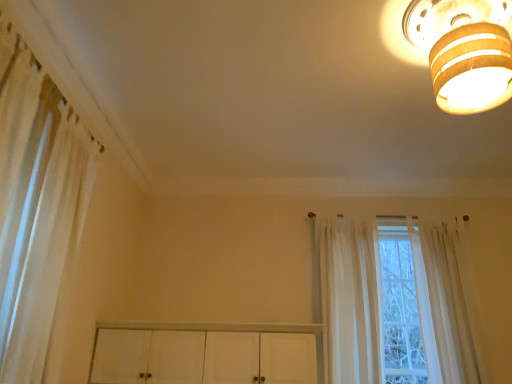
What do you see at coordinates (38, 213) in the screenshot?
I see `white sheer curtain at left, placed as the 1th curtain when sorted from left to right` at bounding box center [38, 213].

Image resolution: width=512 pixels, height=384 pixels. Identify the location of sheer white curtain at center, which appears as the 2th curtain when viewed from the right. (350, 300).

Locate an element on the screen. This screenshot has height=384, width=512. white sheer curtain at left, placed as the 1th curtain when sorted from left to right is located at coordinates (38, 213).

Is white sheer curtain at left, placed as the 1th curtain when sorted from left to right, inside or outside of sheer white curtain at right, which appears as the 3th curtain when viewed from the left?

white sheer curtain at left, placed as the 1th curtain when sorted from left to right, is outside sheer white curtain at right, which appears as the 3th curtain when viewed from the left.

How distant is white sheer curtain at left, marked as the third curtain in a right-to-left arrangement, from sheer white curtain at right, the 1th curtain from the right?

white sheer curtain at left, marked as the third curtain in a right-to-left arrangement, and sheer white curtain at right, the 1th curtain from the right, are 9.21 feet apart from each other.

Does point (56, 311) come behind point (450, 381)?

No, it is in front of (450, 381).

In terms of width, does white sheer curtain at left, marked as the third curtain in a right-to-left arrangement, look wider or thinner when compared to sheer white curtain at right, the 1th curtain from the right?

In the image, white sheer curtain at left, marked as the third curtain in a right-to-left arrangement, appears to be more narrow than sheer white curtain at right, the 1th curtain from the right.

Could you tell me if sheer white curtain at right, the 1th curtain from the right, is turned towards sheer white curtain at center, which appears as the 2th curtain when viewed from the right?

No, sheer white curtain at right, the 1th curtain from the right, is not turned towards sheer white curtain at center, which appears as the 2th curtain when viewed from the right.

Based on the photo, can you confirm if sheer white curtain at right, the 1th curtain from the right, is taller than sheer white curtain at center, positioned as the 2th curtain in left-to-right order?

Incorrect, the height of sheer white curtain at right, the 1th curtain from the right, is not larger of that of sheer white curtain at center, positioned as the 2th curtain in left-to-right order.

Is sheer white curtain at right, which appears as the 3th curtain when viewed from the left, spatially inside sheer white curtain at center, which appears as the 2th curtain when viewed from the right, or outside of it?

sheer white curtain at right, which appears as the 3th curtain when viewed from the left, cannot be found inside sheer white curtain at center, which appears as the 2th curtain when viewed from the right.

Which object is positioned more to the right, sheer white curtain at right, the 1th curtain from the right, or sheer white curtain at center, which appears as the 2th curtain when viewed from the right?

Positioned to the right is sheer white curtain at right, the 1th curtain from the right.

Consider the image. Is wooden ceiling light at upper right oriented away from white sheer curtain at left, placed as the 1th curtain when sorted from left to right?

No, wooden ceiling light at upper right is not facing the opposite direction of white sheer curtain at left, placed as the 1th curtain when sorted from left to right.

Is white sheer curtain at left, marked as the third curtain in a right-to-left arrangement, completely or partially inside wooden ceiling light at upper right?

No, white sheer curtain at left, marked as the third curtain in a right-to-left arrangement, is not surrounded by wooden ceiling light at upper right.

Is wooden ceiling light at upper right in contact with white sheer curtain at left, placed as the 1th curtain when sorted from left to right?

wooden ceiling light at upper right and white sheer curtain at left, placed as the 1th curtain when sorted from left to right, are not in contact.

From the picture: From the image's perspective, which is below, wooden ceiling light at upper right or white sheer curtain at left, placed as the 1th curtain when sorted from left to right?

From the image's view, white sheer curtain at left, placed as the 1th curtain when sorted from left to right, is below.

Who is bigger, sheer white curtain at center, which appears as the 2th curtain when viewed from the right, or sheer white curtain at right, which appears as the 3th curtain when viewed from the left?

sheer white curtain at right, which appears as the 3th curtain when viewed from the left.

Consider the image. Is sheer white curtain at center, which appears as the 2th curtain when viewed from the right, next to sheer white curtain at right, the 1th curtain from the right?

No, sheer white curtain at center, which appears as the 2th curtain when viewed from the right, is not in contact with sheer white curtain at right, the 1th curtain from the right.

Could sheer white curtain at right, which appears as the 3th curtain when viewed from the left, be considered to be inside sheer white curtain at center, which appears as the 2th curtain when viewed from the right?

No, sheer white curtain at right, which appears as the 3th curtain when viewed from the left, is not inside sheer white curtain at center, which appears as the 2th curtain when viewed from the right.

Is sheer white curtain at center, positioned as the 2th curtain in left-to-right order, shorter than sheer white curtain at right, which appears as the 3th curtain when viewed from the left?

In fact, sheer white curtain at center, positioned as the 2th curtain in left-to-right order, may be taller than sheer white curtain at right, which appears as the 3th curtain when viewed from the left.

Is white sheer curtain at left, placed as the 1th curtain when sorted from left to right, inside sheer white curtain at right, the 1th curtain from the right?

No, white sheer curtain at left, placed as the 1th curtain when sorted from left to right, is not a part of sheer white curtain at right, the 1th curtain from the right.

Is sheer white curtain at right, the 1th curtain from the right, touching white sheer curtain at left, placed as the 1th curtain when sorted from left to right?

No, sheer white curtain at right, the 1th curtain from the right, is not in contact with white sheer curtain at left, placed as the 1th curtain when sorted from left to right.

At what (x,y) coordinates should I click in order to perform the action: click on the 2nd curtain above the sheer white curtain at right, the 1th curtain from the right (from the image's perspective). Please return your answer as a coordinate pair (x, y). This screenshot has width=512, height=384. Looking at the image, I should click on (38, 213).

The image size is (512, 384). There is a white sheer curtain at left, placed as the 1th curtain when sorted from left to right. What are the coordinates of `the 1st curtain below it (from the image's perspective)` in the screenshot? It's located at (350, 300).

Looking at this image, considering the sizes of objects white sheer curtain at left, marked as the third curtain in a right-to-left arrangement, and sheer white curtain at center, which appears as the 2th curtain when viewed from the right, in the image provided, who is taller, white sheer curtain at left, marked as the third curtain in a right-to-left arrangement, or sheer white curtain at center, which appears as the 2th curtain when viewed from the right,?

white sheer curtain at left, marked as the third curtain in a right-to-left arrangement.

Can you confirm if white sheer curtain at left, placed as the 1th curtain when sorted from left to right, is smaller than sheer white curtain at center, which appears as the 2th curtain when viewed from the right?

Yes, white sheer curtain at left, placed as the 1th curtain when sorted from left to right, is smaller than sheer white curtain at center, which appears as the 2th curtain when viewed from the right.

Is sheer white curtain at right, the 1th curtain from the right, not close to wooden ceiling light at upper right?

Yes.

Can you tell me how much sheer white curtain at right, the 1th curtain from the right, and wooden ceiling light at upper right differ in facing direction?

There is a 14.4-degree angle between the facing directions of sheer white curtain at right, the 1th curtain from the right, and wooden ceiling light at upper right.

From the picture: Does sheer white curtain at right, the 1th curtain from the right, have a lesser height compared to wooden ceiling light at upper right?

In fact, sheer white curtain at right, the 1th curtain from the right, may be taller than wooden ceiling light at upper right.

Based on the photo, is sheer white curtain at right, which appears as the 3th curtain when viewed from the left, closer to the viewer compared to wooden ceiling light at upper right?

No, it is not.

This screenshot has width=512, height=384. Identify the location of the 2nd curtain to the left of the sheer white curtain at right, which appears as the 3th curtain when viewed from the left, starting your count from the anchor. (38, 213).

Where is `curtain that appears behind the sheer white curtain at right, which appears as the 3th curtain when viewed from the left`? This screenshot has height=384, width=512. curtain that appears behind the sheer white curtain at right, which appears as the 3th curtain when viewed from the left is located at coordinates (350, 300).

Based on their spatial positions, is wooden ceiling light at upper right or sheer white curtain at right, the 1th curtain from the right, further from sheer white curtain at center, which appears as the 2th curtain when viewed from the right?

Among the two, wooden ceiling light at upper right is located further to sheer white curtain at center, which appears as the 2th curtain when viewed from the right.

From the image, which object appears to be nearer to wooden ceiling light at upper right, sheer white curtain at center, positioned as the 2th curtain in left-to-right order, or white sheer curtain at left, placed as the 1th curtain when sorted from left to right?

sheer white curtain at center, positioned as the 2th curtain in left-to-right order, is positioned closer to the anchor wooden ceiling light at upper right.

Based on their spatial positions, is wooden ceiling light at upper right or sheer white curtain at center, which appears as the 2th curtain when viewed from the right, closer to sheer white curtain at right, the 1th curtain from the right?

sheer white curtain at center, which appears as the 2th curtain when viewed from the right, is positioned closer to the anchor sheer white curtain at right, the 1th curtain from the right.

Which object lies nearer to the anchor point sheer white curtain at center, which appears as the 2th curtain when viewed from the right, white sheer curtain at left, placed as the 1th curtain when sorted from left to right, or sheer white curtain at right, the 1th curtain from the right?

Among the two, sheer white curtain at right, the 1th curtain from the right, is located nearer to sheer white curtain at center, which appears as the 2th curtain when viewed from the right.

Which object lies further to the anchor point wooden ceiling light at upper right, white sheer curtain at left, placed as the 1th curtain when sorted from left to right, or sheer white curtain at right, the 1th curtain from the right?

white sheer curtain at left, placed as the 1th curtain when sorted from left to right, is further to wooden ceiling light at upper right.

Based on their spatial positions, is sheer white curtain at center, which appears as the 2th curtain when viewed from the right, or sheer white curtain at right, which appears as the 3th curtain when viewed from the left, further from wooden ceiling light at upper right?

sheer white curtain at right, which appears as the 3th curtain when viewed from the left, lies further to wooden ceiling light at upper right than the other object.

Considering their positions, is sheer white curtain at right, which appears as the 3th curtain when viewed from the left, positioned further to wooden ceiling light at upper right than white sheer curtain at left, placed as the 1th curtain when sorted from left to right?

white sheer curtain at left, placed as the 1th curtain when sorted from left to right.

Which object lies nearer to the anchor point sheer white curtain at center, which appears as the 2th curtain when viewed from the right, sheer white curtain at right, the 1th curtain from the right, or wooden ceiling light at upper right?

Based on the image, sheer white curtain at right, the 1th curtain from the right, appears to be nearer to sheer white curtain at center, which appears as the 2th curtain when viewed from the right.

Find the location of a particular element. This screenshot has width=512, height=384. curtain between white sheer curtain at left, placed as the 1th curtain when sorted from left to right, and sheer white curtain at right, which appears as the 3th curtain when viewed from the left, from left to right is located at coordinates (350, 300).

Locate an element on the screen. curtain situated between white sheer curtain at left, marked as the third curtain in a right-to-left arrangement, and wooden ceiling light at upper right from left to right is located at coordinates (350, 300).

At what (x,y) coordinates should I click in order to perform the action: click on lamp situated between white sheer curtain at left, marked as the third curtain in a right-to-left arrangement, and sheer white curtain at right, the 1th curtain from the right, from left to right. Please return your answer as a coordinate pair (x, y). Looking at the image, I should click on (464, 50).